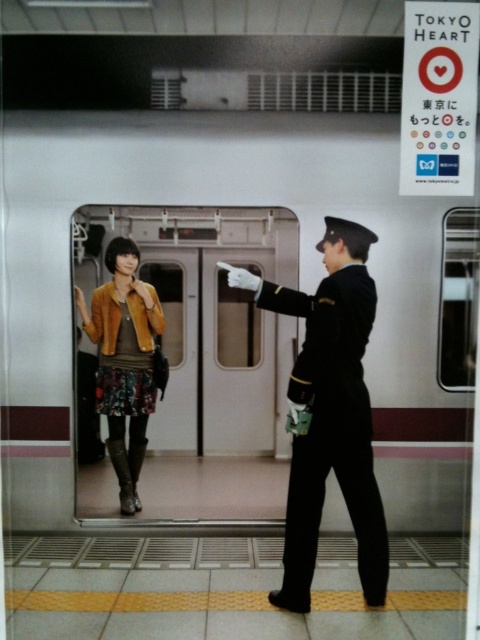
You are standing at point (294, 528). The train doors are about to close. Can you reach the train before the doors close if you run at 2 meters per second?

The distance between you and the train is 3.10 meters. Running at 2 meters per second, you would need 1.55 seconds to cover the distance. Whether you can reach before the doors close depends on the closing time of the doors, which isn

You are a photographer standing near the black wool uniform at right. You want to take a photo of the camera. Is the camera within your reach without moving from your current position?

The black wool uniform at right and camera are 2.91 meters apart. Since the distance is 2.91 meters, which is beyond typical arm reach, the camera is out of reach without moving.

Looking at this image, you are a photographer trying to capture a photo of both the black wool uniform at right and the velvet brown jacket at center. Since you can only focus on one subject at a time, which one should you choose to ensure the other is still visible in the frame?

You should focus on the velvet brown jacket at center because the black wool uniform at right is positioned on the right side of it, meaning the velvet brown jacket at center is closer to the center of the frame and the black wool uniform at right will still be visible on its right side.